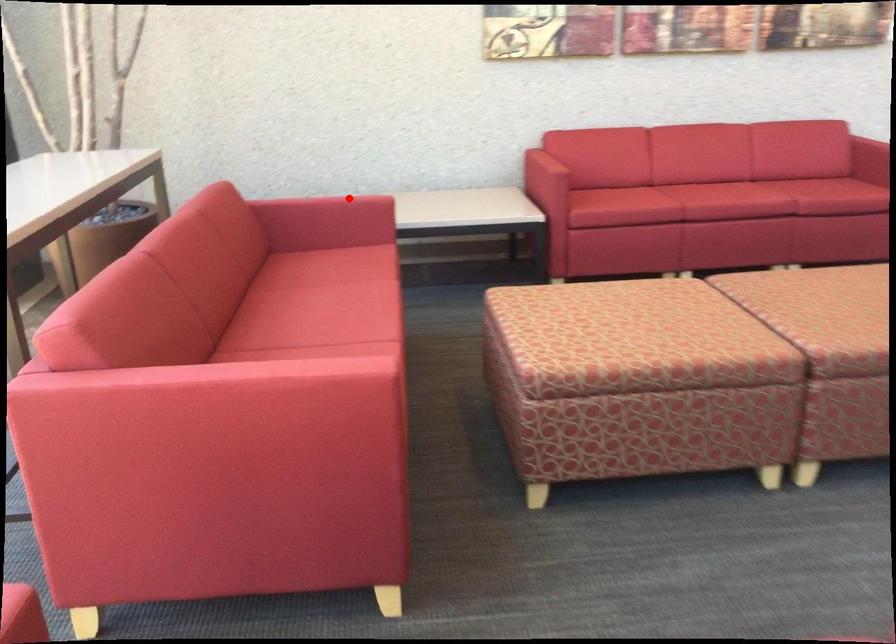
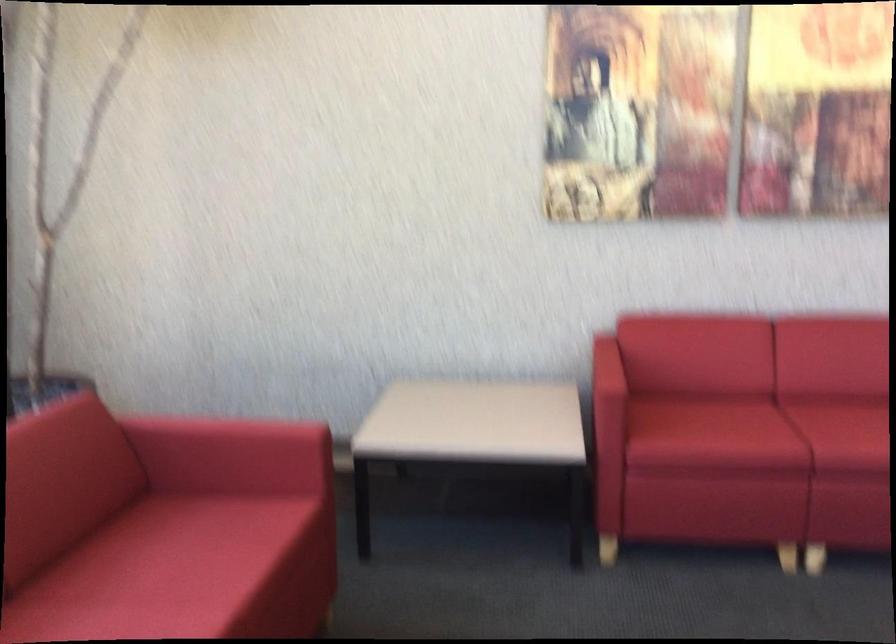
In the second image, find the point that corresponds to the highlighted location in the first image.

(261, 431)